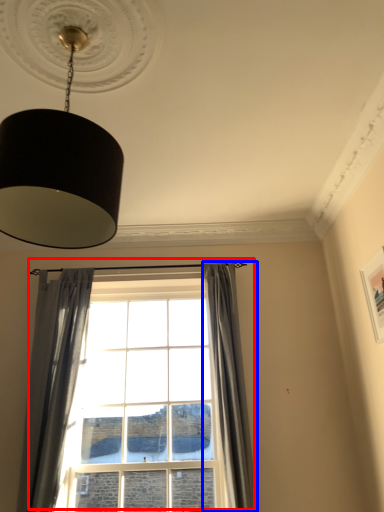
Question: Which of the following is the farthest to the observer, window (highlighted by a red box) or curtain (highlighted by a blue box)?

Choices:
 (A) window
 (B) curtain

Answer: (A)